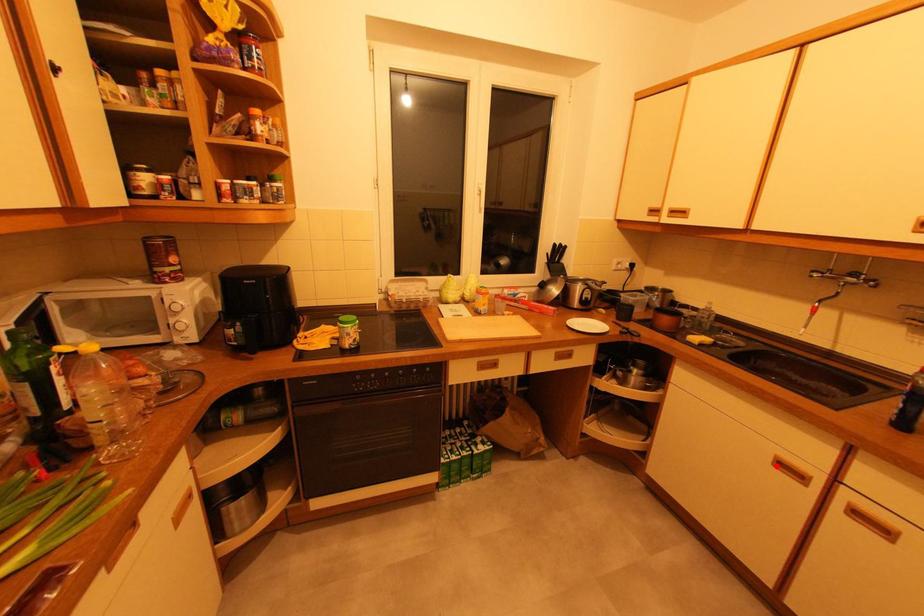
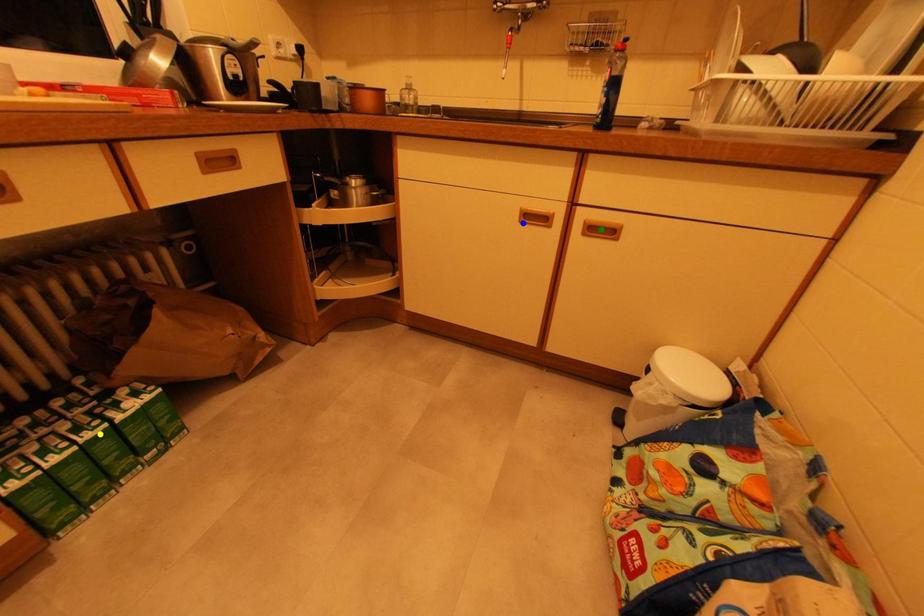
Question: I am providing you with two images of the same scene from different viewpoints. A red point is marked on the first image. You are given multiple points on the second image. Which point in image 2 is actually the same real-world point as the red point in image 1?

Choices:
 (A) yellow point
 (B) blue point
 (C) green point

Answer: (B)